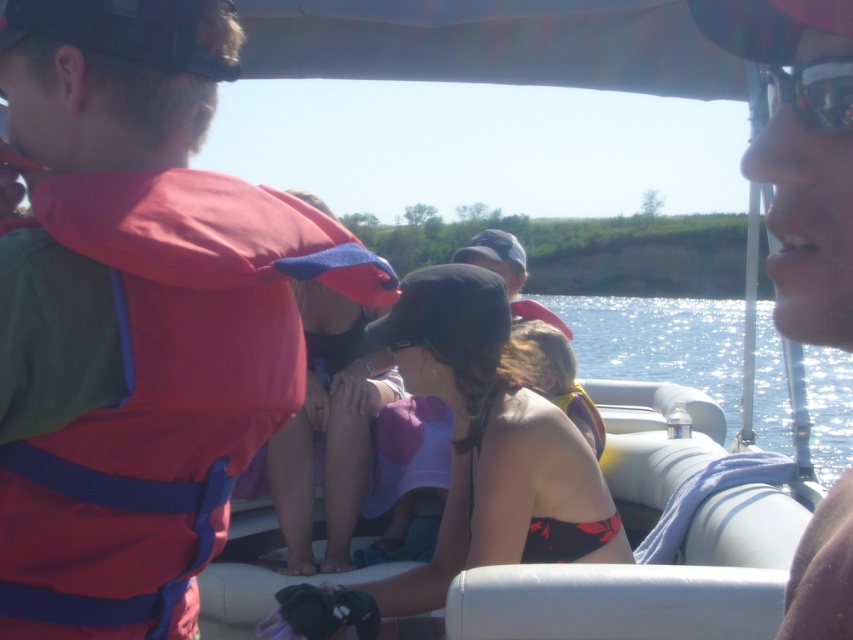
You are a photographer on the boat and want to capture a photo where the matte red life vest at left and the glistening water at center are both visible. Based on their positions, which object should you focus on first to ensure both are in frame?

The matte red life vest at left is located below the glistening water at center, so focusing on the glistening water at center first would allow the matte red life vest at left to naturally fall into the frame below it.

You are planning to place a new object on the boat. The object requires a space larger than the matte red life vest at left. Can the glistening water at center provide enough space for it?

The matte red life vest at left has a smaller size compared to glistening water at center, so yes, the glistening water at center can provide enough space for the object since it is larger than the matte red life vest at left.

Where is the matte black bikini top at center located in the image?

The matte black bikini top at center is located at point coordinates of 0.667 on the x axis and 0.387 on the y axis.